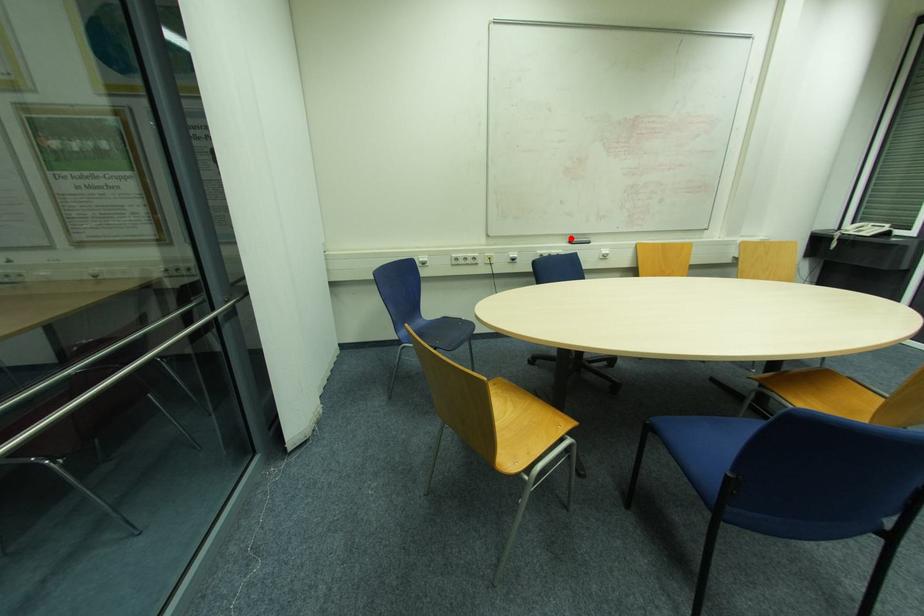
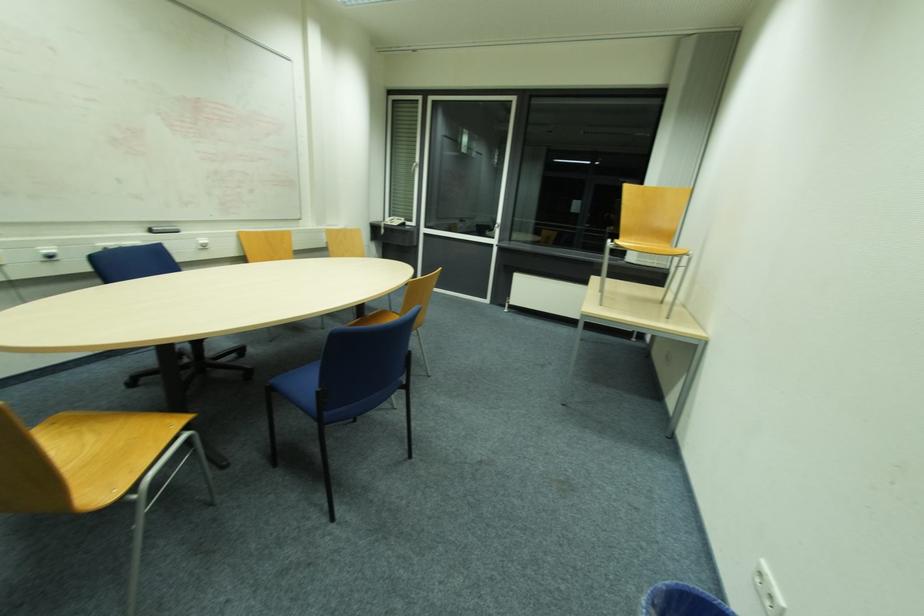
Question: A red point is marked in image1. In image2, is the corresponding 3D point closer to the camera or farther? Reply with the corresponding letter.

Choices:
 (A) The corresponding 3D point is closer.
 (B) The corresponding 3D point is farther.

Answer: (B)